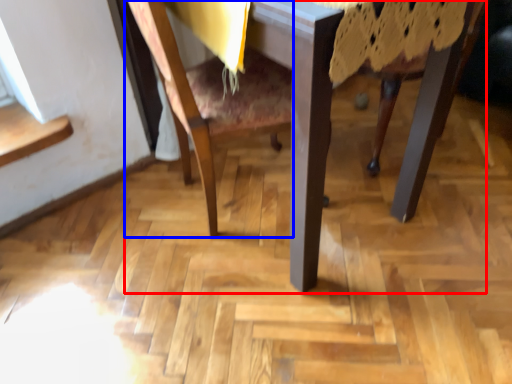
Question: Which point is closer to the camera, table (highlighted by a red box) or chair (highlighted by a blue box)?

Choices:
 (A) table
 (B) chair

Answer: (A)